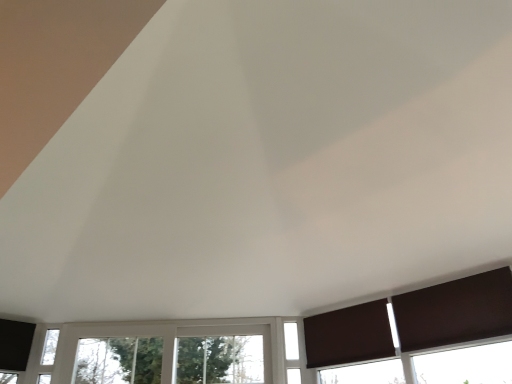
Find the location of a particular element. The width and height of the screenshot is (512, 384). white glass window at center, which appears as the first window when viewed from the right is located at coordinates coord(292,353).

You are a GUI agent. You are given a task and a screenshot of the screen. Output one action in this format:
    pyautogui.click(x=<x>, y=<y>)
    Task: Click on the brown matte curtain at lower right, the 2th curtain in the left-to-right sequence
    
    Given the screenshot: What is the action you would take?
    pyautogui.click(x=455, y=311)

This screenshot has width=512, height=384. I want to click on white glass window at center, which appears as the first window when viewed from the right, so click(292, 353).

Are brown matte curtain at lower right, which ranks as the first curtain in right-to-left order, and brown matte curtain at lower right, which is the first curtain in back-to-front order, beside each other?

No, brown matte curtain at lower right, which ranks as the first curtain in right-to-left order, is not making contact with brown matte curtain at lower right, which is the first curtain in back-to-front order.

Does brown matte curtain at lower right, placed as the second curtain when sorted from back to front, have a greater width compared to brown matte curtain at lower right, the 2th curtain from the right?

Yes, brown matte curtain at lower right, placed as the second curtain when sorted from back to front, is wider than brown matte curtain at lower right, the 2th curtain from the right.

Consider the image. What's the angular difference between brown matte curtain at lower right, the 2th curtain in the left-to-right sequence, and brown matte curtain at lower right, arranged as the first curtain when viewed from the left,'s facing directions?

The facing directions of brown matte curtain at lower right, the 2th curtain in the left-to-right sequence, and brown matte curtain at lower right, arranged as the first curtain when viewed from the left, are 1.39 degrees apart.

Does point (421, 339) appear closer or farther from the camera than point (345, 338)?

Point (421, 339) is closer to the camera than point (345, 338).

Could you tell me if brown matte curtain at lower right, placed as the second curtain when sorted from back to front, is turned towards white plastic window at center, marked as the second window in a right-to-left arrangement?

No, brown matte curtain at lower right, placed as the second curtain when sorted from back to front, is not facing towards white plastic window at center, marked as the second window in a right-to-left arrangement.

Does point (462, 340) lie in front of point (172, 372)?

Yes.

The image size is (512, 384). Identify the location of window that is the 2nd one when counting leftward from the brown matte curtain at lower right, the 2th curtain in the left-to-right sequence. (173, 354).

Is white plastic window at center, placed as the first window when sorted from left to right, turned away from brown matte curtain at lower right, which ranks as the first curtain in right-to-left order?

No, white plastic window at center, placed as the first window when sorted from left to right, is not facing away from brown matte curtain at lower right, which ranks as the first curtain in right-to-left order.

From the image's perspective, is white plastic window at center, placed as the first window when sorted from left to right, over brown matte curtain at lower right, placed as the second curtain when sorted from back to front?

Incorrect, from the image's perspective, white plastic window at center, placed as the first window when sorted from left to right, is lower than brown matte curtain at lower right, placed as the second curtain when sorted from back to front.

From a real-world perspective, is white plastic window at center, placed as the first window when sorted from left to right, located higher than brown matte curtain at lower right, placed as the second curtain when sorted from back to front?

No, from a real-world perspective, white plastic window at center, placed as the first window when sorted from left to right, is not above brown matte curtain at lower right, placed as the second curtain when sorted from back to front.

Can you tell me how much white plastic window at center, marked as the second window in a right-to-left arrangement, and brown matte curtain at lower right, the 2th curtain in the left-to-right sequence, differ in facing direction?

47.4 degrees separate the facing orientations of white plastic window at center, marked as the second window in a right-to-left arrangement, and brown matte curtain at lower right, the 2th curtain in the left-to-right sequence.

Considering the sizes of objects white glass window at center, which appears as the first window when viewed from the right, and brown matte curtain at lower right, arranged as the first curtain when viewed from the left, in the image provided, who is wider, white glass window at center, which appears as the first window when viewed from the right, or brown matte curtain at lower right, arranged as the first curtain when viewed from the left,?

white glass window at center, which appears as the first window when viewed from the right, is wider.

From a real-world perspective, is white glass window at center, which appears as the first window when viewed from the right, above or below brown matte curtain at lower right, which is the first curtain in back-to-front order?

white glass window at center, which appears as the first window when viewed from the right, is below brown matte curtain at lower right, which is the first curtain in back-to-front order.

Could brown matte curtain at lower right, the 2th curtain from the right, be considered to be inside white glass window at center, which appears as the first window when viewed from the right?

No, brown matte curtain at lower right, the 2th curtain from the right, is not surrounded by white glass window at center, which appears as the first window when viewed from the right.

Is white glass window at center, which appears as the first window when viewed from the right, looking in the opposite direction of brown matte curtain at lower right, the 2th curtain from the right?

No, white glass window at center, which appears as the first window when viewed from the right,'s orientation is not away from brown matte curtain at lower right, the 2th curtain from the right.

Considering the relative sizes of white plastic window at center, placed as the first window when sorted from left to right, and white glass window at center, which appears as the first window when viewed from the right, in the image provided, is white plastic window at center, placed as the first window when sorted from left to right, thinner than white glass window at center, which appears as the first window when viewed from the right,?

No, white plastic window at center, placed as the first window when sorted from left to right, is not thinner than white glass window at center, which appears as the first window when viewed from the right.

In the image, is white plastic window at center, placed as the first window when sorted from left to right, positioned in front of or behind white glass window at center, which appears as the first window when viewed from the right?

white plastic window at center, placed as the first window when sorted from left to right, is positioned closer to the viewer than white glass window at center, which appears as the first window when viewed from the right.

The height and width of the screenshot is (384, 512). I want to click on window that is behind the white plastic window at center, placed as the first window when sorted from left to right, so click(x=292, y=353).

From a real-world perspective, which is physically below, white plastic window at center, placed as the first window when sorted from left to right, or white glass window at center, which appears as the first window when viewed from the right?

white glass window at center, which appears as the first window when viewed from the right, from a real-world perspective.

Is white glass window at center, which appears as the first window when viewed from the right, situated inside brown matte curtain at lower right, the 1th curtain when ordered from front to back, or outside?

white glass window at center, which appears as the first window when viewed from the right, is outside brown matte curtain at lower right, the 1th curtain when ordered from front to back.

From a real-world perspective, between white glass window at center, the 2th window from the left, and brown matte curtain at lower right, the 1th curtain when ordered from front to back, who is vertically higher?

brown matte curtain at lower right, the 1th curtain when ordered from front to back.

Considering the relative positions of white glass window at center, which appears as the first window when viewed from the right, and brown matte curtain at lower right, the 1th curtain when ordered from front to back, in the image provided, is white glass window at center, which appears as the first window when viewed from the right, behind brown matte curtain at lower right, the 1th curtain when ordered from front to back,?

Yes, it is.

Considering the relative sizes of white glass window at center, the 2th window from the left, and brown matte curtain at lower right, the 2th curtain in the left-to-right sequence, in the image provided, is white glass window at center, the 2th window from the left, shorter than brown matte curtain at lower right, the 2th curtain in the left-to-right sequence,?

In fact, white glass window at center, the 2th window from the left, may be taller than brown matte curtain at lower right, the 2th curtain in the left-to-right sequence.

Is brown matte curtain at lower right, the 2th curtain from the right, turned away from brown matte curtain at lower right, placed as the second curtain when sorted from back to front?

brown matte curtain at lower right, the 2th curtain from the right, is not turned away from brown matte curtain at lower right, placed as the second curtain when sorted from back to front.

Can you confirm if brown matte curtain at lower right, arranged as the first curtain when viewed from the left, is positioned to the right of brown matte curtain at lower right, the 1th curtain when ordered from front to back?

No, brown matte curtain at lower right, arranged as the first curtain when viewed from the left, is not to the right of brown matte curtain at lower right, the 1th curtain when ordered from front to back.

From a real-world perspective, which is physically above, brown matte curtain at lower right, which is the first curtain in back-to-front order, or brown matte curtain at lower right, the 1th curtain when ordered from front to back?

brown matte curtain at lower right, which is the first curtain in back-to-front order.

Is brown matte curtain at lower right, arranged as the first curtain when viewed from the left, far from brown matte curtain at lower right, the 2th curtain in the left-to-right sequence?

No, brown matte curtain at lower right, arranged as the first curtain when viewed from the left, is not far from brown matte curtain at lower right, the 2th curtain in the left-to-right sequence.

The width and height of the screenshot is (512, 384). I want to click on curtain below the brown matte curtain at lower right, the 1th curtain when ordered from front to back (from the image's perspective), so [349, 335].

Identify the location of curtain that is the 2nd one when counting forward from the white plastic window at center, placed as the first window when sorted from left to right. (455, 311).

Looking at the image, which one is located further to brown matte curtain at lower right, the 2th curtain in the left-to-right sequence, white glass window at center, which appears as the first window when viewed from the right, or white plastic window at center, marked as the second window in a right-to-left arrangement?

The object further to brown matte curtain at lower right, the 2th curtain in the left-to-right sequence, is white plastic window at center, marked as the second window in a right-to-left arrangement.

Which object lies further to the anchor point white glass window at center, the 2th window from the left, brown matte curtain at lower right, placed as the second curtain when sorted from back to front, or brown matte curtain at lower right, which is the first curtain in back-to-front order?

brown matte curtain at lower right, placed as the second curtain when sorted from back to front.

Based on the photo, estimate the real-world distances between objects in this image. Which object is further from brown matte curtain at lower right, arranged as the first curtain when viewed from the left, white glass window at center, the 2th window from the left, or brown matte curtain at lower right, the 1th curtain when ordered from front to back?

brown matte curtain at lower right, the 1th curtain when ordered from front to back, is positioned further to the anchor brown matte curtain at lower right, arranged as the first curtain when viewed from the left.

Consider the image. Considering their positions, is white glass window at center, which appears as the first window when viewed from the right, positioned further to brown matte curtain at lower right, arranged as the first curtain when viewed from the left, than white plastic window at center, marked as the second window in a right-to-left arrangement?

white plastic window at center, marked as the second window in a right-to-left arrangement, is positioned further to the anchor brown matte curtain at lower right, arranged as the first curtain when viewed from the left.

Which object lies further to the anchor point white glass window at center, which appears as the first window when viewed from the right, brown matte curtain at lower right, which is the first curtain in back-to-front order, or brown matte curtain at lower right, placed as the second curtain when sorted from back to front?

brown matte curtain at lower right, placed as the second curtain when sorted from back to front, is positioned further to the anchor white glass window at center, which appears as the first window when viewed from the right.

Looking at the image, which one is located further to white plastic window at center, placed as the first window when sorted from left to right, brown matte curtain at lower right, arranged as the first curtain when viewed from the left, or white glass window at center, which appears as the first window when viewed from the right?

brown matte curtain at lower right, arranged as the first curtain when viewed from the left.

Which object lies nearer to the anchor point white plastic window at center, placed as the first window when sorted from left to right, brown matte curtain at lower right, which is the first curtain in back-to-front order, or brown matte curtain at lower right, the 2th curtain in the left-to-right sequence?

Among the two, brown matte curtain at lower right, which is the first curtain in back-to-front order, is located nearer to white plastic window at center, placed as the first window when sorted from left to right.

When comparing their distances from brown matte curtain at lower right, the 2th curtain in the left-to-right sequence, does brown matte curtain at lower right, which is the first curtain in back-to-front order, or white plastic window at center, marked as the second window in a right-to-left arrangement, seem further?

white plastic window at center, marked as the second window in a right-to-left arrangement, lies further to brown matte curtain at lower right, the 2th curtain in the left-to-right sequence, than the other object.

Image resolution: width=512 pixels, height=384 pixels. In order to click on window situated between white plastic window at center, marked as the second window in a right-to-left arrangement, and brown matte curtain at lower right, the 1th curtain when ordered from front to back, from left to right in this screenshot , I will do `click(292, 353)`.

I want to click on curtain positioned between brown matte curtain at lower right, the 1th curtain when ordered from front to back, and white glass window at center, the 2th window from the left, from near to far, so click(x=349, y=335).

Where is `window between white plastic window at center, marked as the second window in a right-to-left arrangement, and brown matte curtain at lower right, arranged as the first curtain when viewed from the left`? window between white plastic window at center, marked as the second window in a right-to-left arrangement, and brown matte curtain at lower right, arranged as the first curtain when viewed from the left is located at coordinates (292, 353).

Where is `curtain between white plastic window at center, marked as the second window in a right-to-left arrangement, and brown matte curtain at lower right, the 1th curtain when ordered from front to back`? The height and width of the screenshot is (384, 512). curtain between white plastic window at center, marked as the second window in a right-to-left arrangement, and brown matte curtain at lower right, the 1th curtain when ordered from front to back is located at coordinates (349, 335).